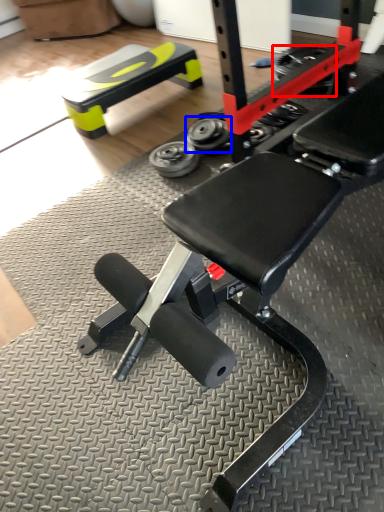
Question: Which of the following is the closest to the observer, tire (highlighted by a red box) or wheel (highlighted by a blue box)?

Choices:
 (A) tire
 (B) wheel

Answer: (B)